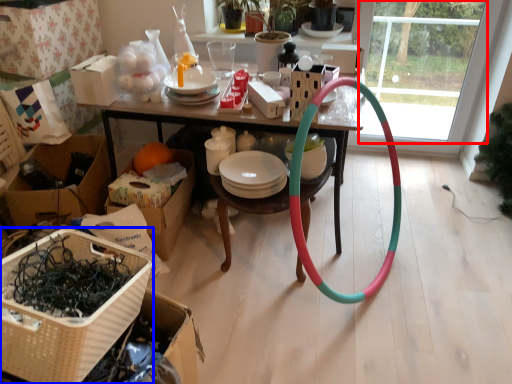
Question: Among these objects, which one is farthest to the camera, glass door (highlighted by a red box) or basket (highlighted by a blue box)?

Choices:
 (A) glass door
 (B) basket

Answer: (A)